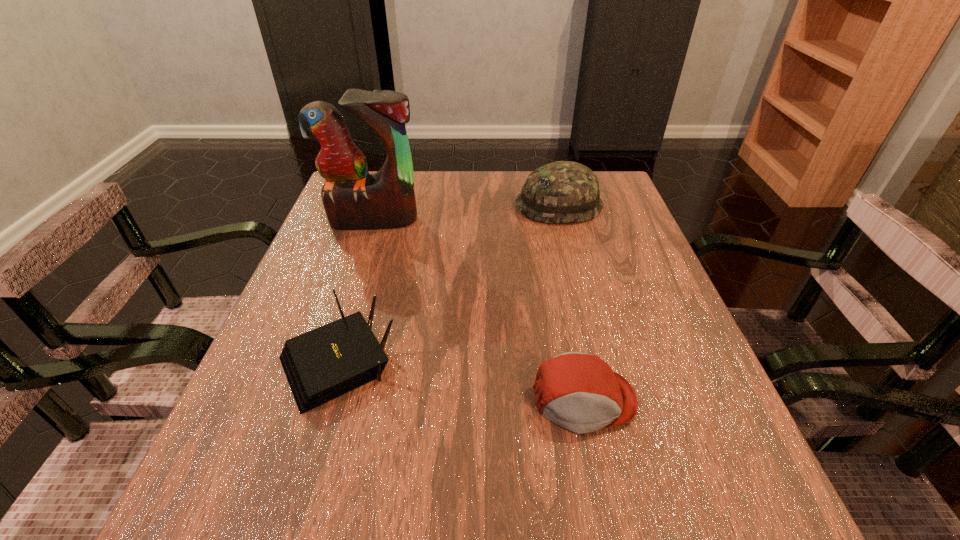
The height and width of the screenshot is (540, 960). I want to click on parrot, so click(x=353, y=199).

Identify the location of the third shortest object. (564, 191).

Where is `the taller cap`? This screenshot has height=540, width=960. the taller cap is located at coordinates (564, 191).

At what (x,y) coordinates should I click in order to perform the action: click on router. Please return your answer as a coordinate pair (x, y). Image resolution: width=960 pixels, height=540 pixels. Looking at the image, I should click on (320, 365).

This screenshot has height=540, width=960. Identify the location of the nearer cap. (580, 392).

Find the location of a particular element. The height and width of the screenshot is (540, 960). vacant area situated at the face of the parrot is located at coordinates (330, 351).

This screenshot has width=960, height=540. I want to click on blank area located on the front of the farther cap, so click(588, 323).

Locate an element on the screen. vacant space located 0.170m on the front of the router is located at coordinates (286, 531).

You are a GUI agent. You are given a task and a screenshot of the screen. Output one action in this format:
    pyautogui.click(x=<x>, y=<y>)
    Task: Click on the free location located on the front-facing side of the nearer cap
    
    Given the screenshot: What is the action you would take?
    pyautogui.click(x=611, y=530)

Locate an element on the screen. Image resolution: width=960 pixels, height=540 pixels. parrot positioned at the far edge is located at coordinates (353, 199).